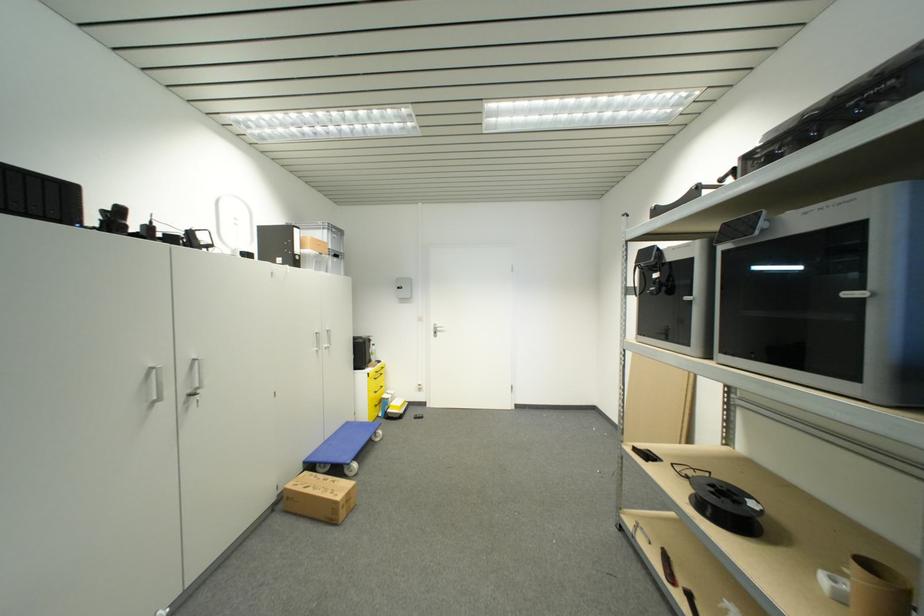
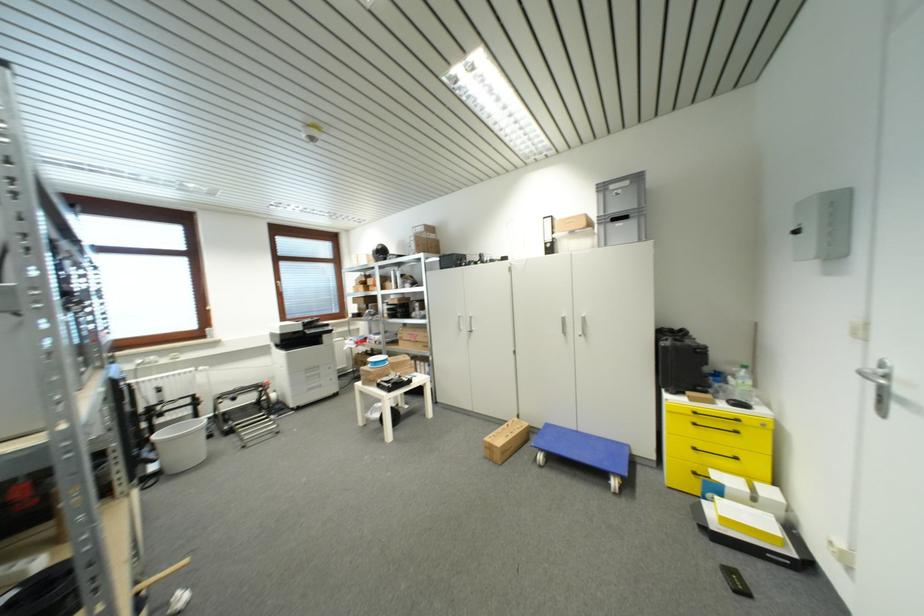
Locate, in the second image, the point that corresponds to pixel 309 464 in the first image.

(552, 427)